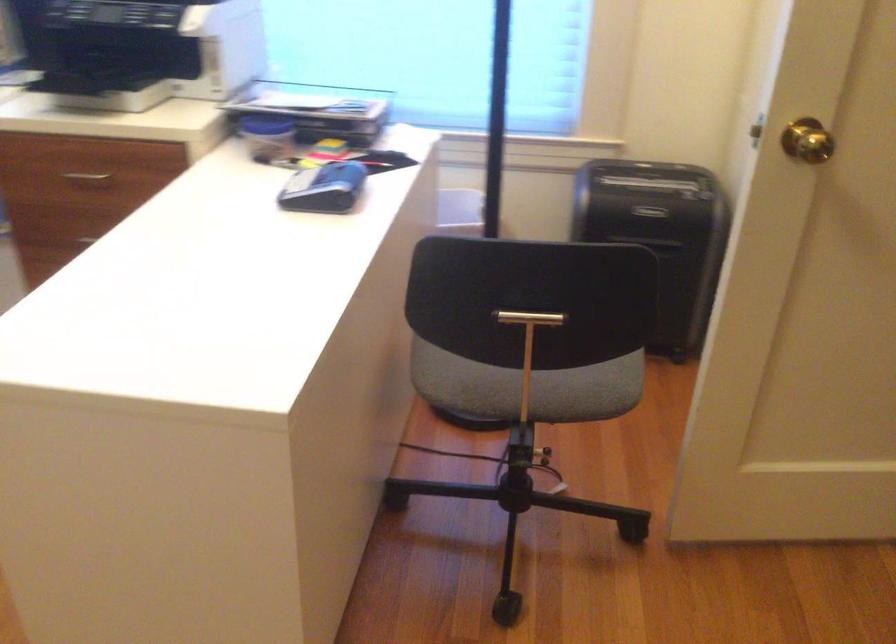
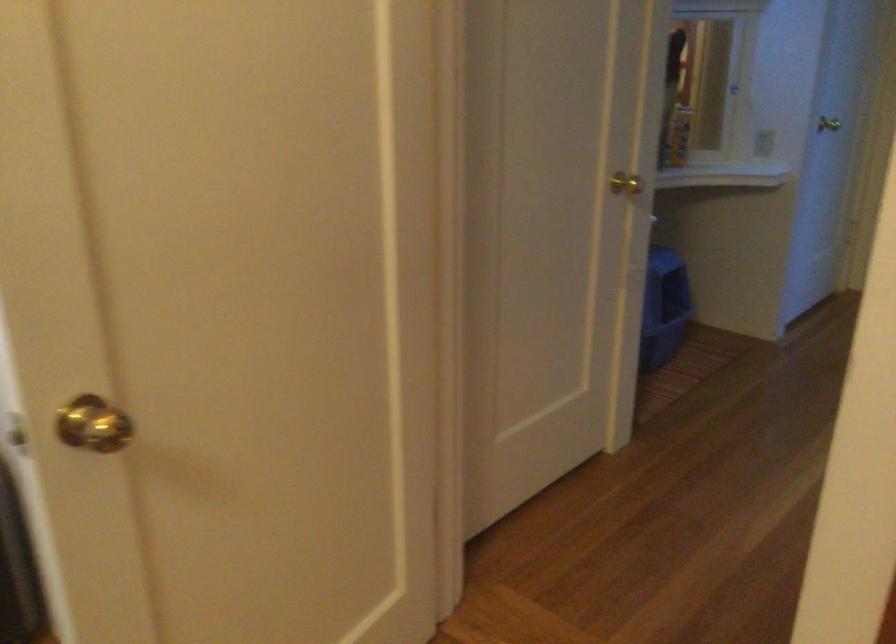
Question: The camera is either moving clockwise (left) or counter-clockwise (right) around the object. The first image is from the beginning of the video and the second image is from the end. Is the camera moving left or right when shooting the video?

Choices:
 (A) Left
 (B) Right

Answer: (A)